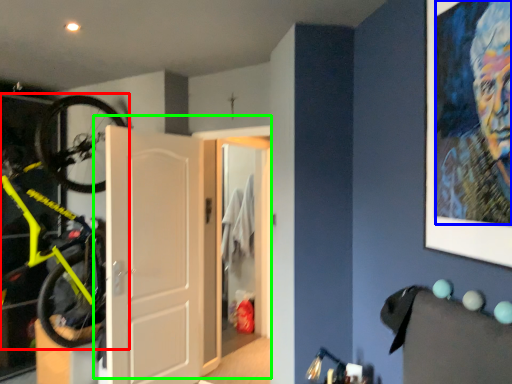
Question: Estimate the real-world distances between objects in this image. Which object is farther from bicycle (highlighted by a red box), person (highlighted by a blue box) or door (highlighted by a green box)?

Choices:
 (A) person
 (B) door

Answer: (A)